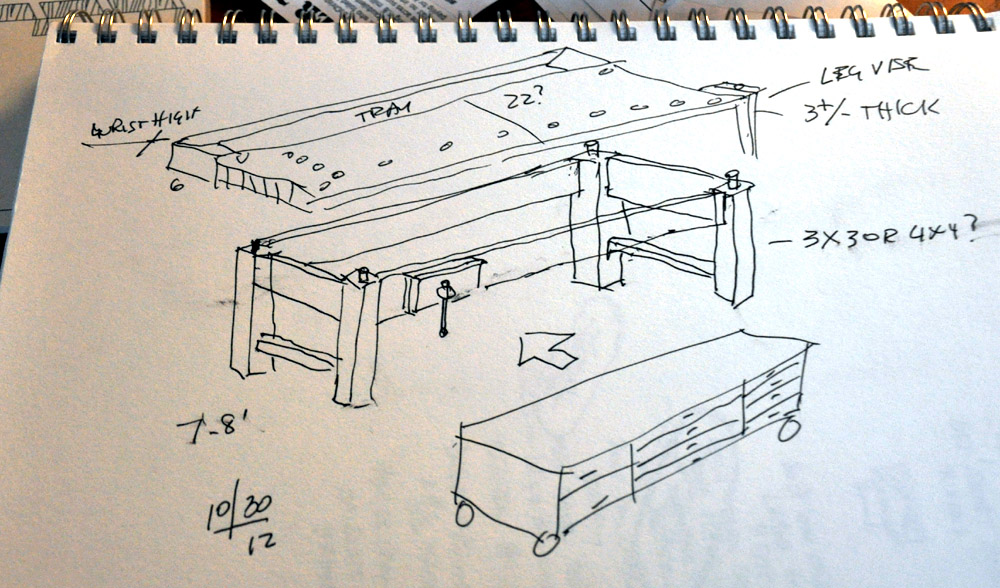
Image resolution: width=1000 pixels, height=588 pixels. I want to click on drawer sketch, so click(603, 473), click(599, 493), click(673, 466), click(667, 456), click(674, 441), click(683, 423), click(778, 415), click(780, 400), click(783, 380), click(797, 360).